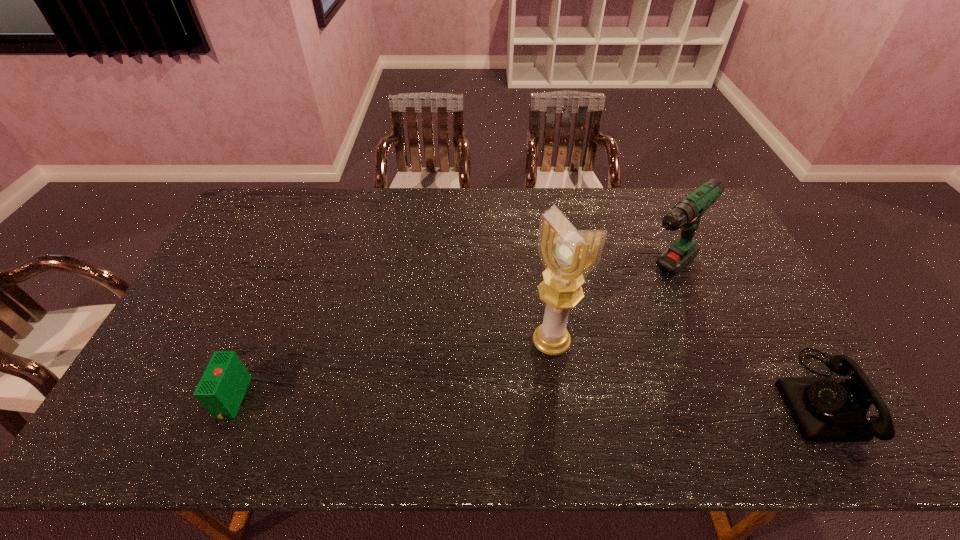
Identify the location of telephone present at the right edge. (825, 409).

The image size is (960, 540). I want to click on drill that is positioned at the right edge, so click(x=686, y=214).

You are a GUI agent. You are given a task and a screenshot of the screen. Output one action in this format:
    pyautogui.click(x=<x>, y=<y>)
    Task: Click on the object that is at the near right corner
    Image resolution: width=960 pixels, height=540 pixels.
    Given the screenshot: What is the action you would take?
    pyautogui.click(x=825, y=409)

The width and height of the screenshot is (960, 540). What are the coordinates of `free space at the far edge of the desktop` in the screenshot? It's located at (343, 195).

In the image, there is a desktop. In order to click on vacant space at the near edge in this screenshot , I will do `click(653, 385)`.

Where is `vacant space at the left edge of the desktop`? vacant space at the left edge of the desktop is located at coordinates (261, 270).

I want to click on vacant area at the right edge, so click(x=747, y=286).

In the image, there is a desktop. At what (x,y) coordinates should I click in order to perform the action: click on vacant space at the near left corner. Please return your answer as a coordinate pair (x, y). The height and width of the screenshot is (540, 960). Looking at the image, I should click on (179, 386).

Locate an element on the screen. The image size is (960, 540). unoccupied area between the alarm clock and the rightmost object is located at coordinates (529, 397).

Locate an element on the screen. The image size is (960, 540). vacant area that lies between the rightmost object and the alarm clock is located at coordinates (529, 397).